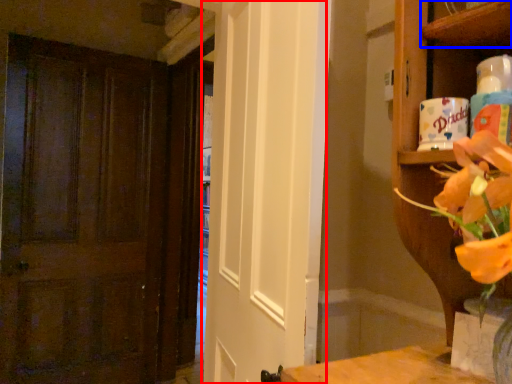
Question: Which of the following is the farthest to the observer, screen door (highlighted by a red box) or shelf (highlighted by a blue box)?

Choices:
 (A) screen door
 (B) shelf

Answer: (A)